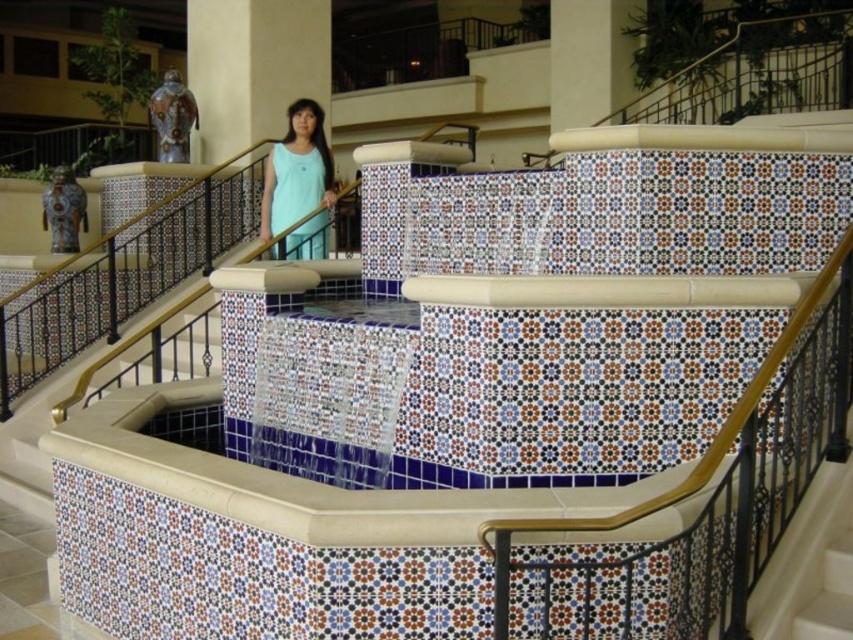
Question: Does light blue fabric dress at center appear under beige marble pillar at upper center?

Choices:
 (A) no
 (B) yes

Answer: (B)

Question: Does matte ceramic vase at upper center appear on the right side of beige marble pillar at upper center?

Choices:
 (A) no
 (B) yes

Answer: (A)

Question: Which point appears farthest from the camera in this image?

Choices:
 (A) (323, 243)
 (B) (297, 33)
 (C) (567, 54)

Answer: (C)

Question: Among these objects, which one is nearest to the camera?

Choices:
 (A) light blue fabric dress at center
 (B) matte ceramic vase at upper center

Answer: (A)

Question: Which object is positioned farthest from the light blue fabric dress at center?

Choices:
 (A) matte ceramic vase at upper center
 (B) beige marble pillar at upper center

Answer: (B)

Question: Is matte ceramic vase at upper center smaller than beige marble pillar at upper center?

Choices:
 (A) yes
 (B) no

Answer: (B)